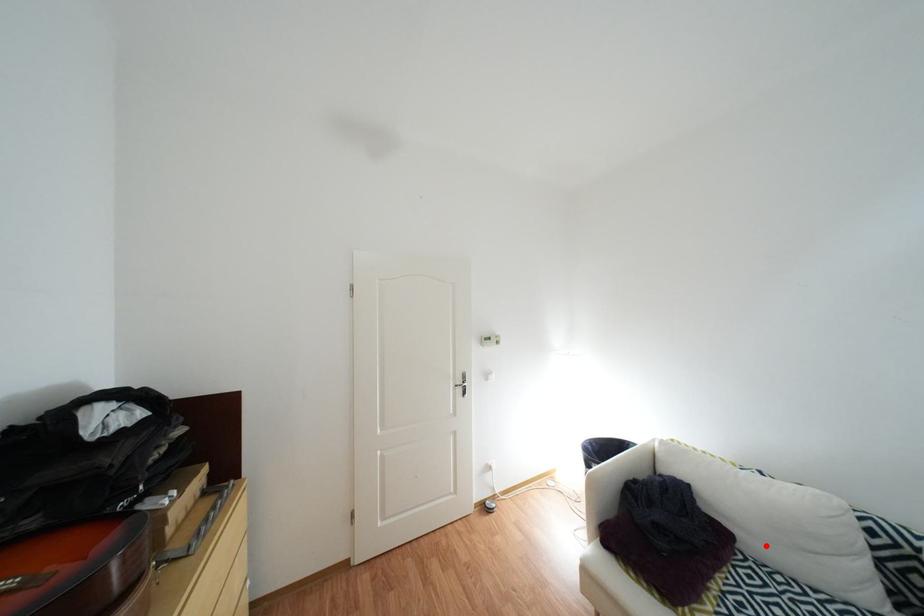
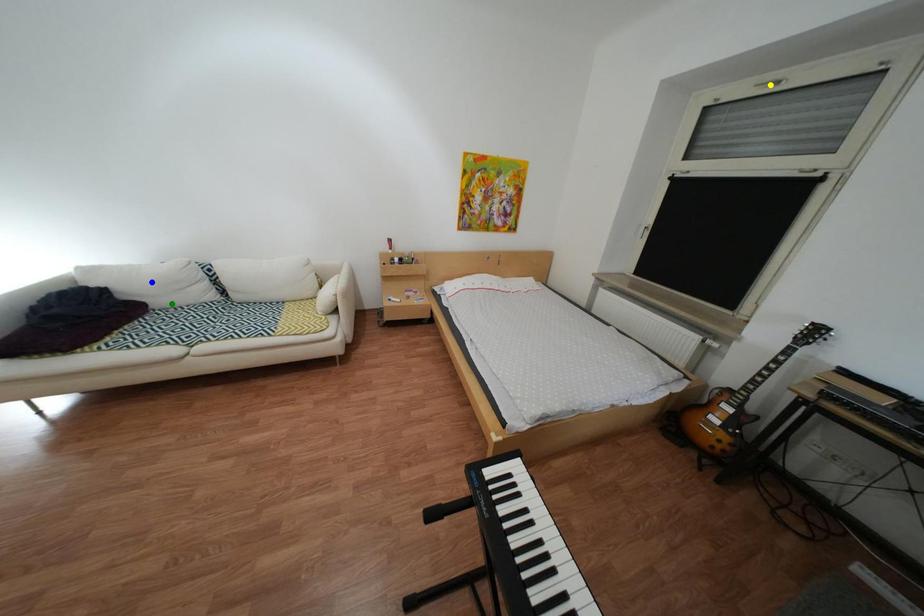
Question: I am providing you with two images of the same scene from different viewpoints. A red point is marked on the first image. You are given multiple points on the second image. In image 2, which mark is for the same physical point as the one in image 1?

Choices:
 (A) green point
 (B) yellow point
 (C) blue point

Answer: (A)